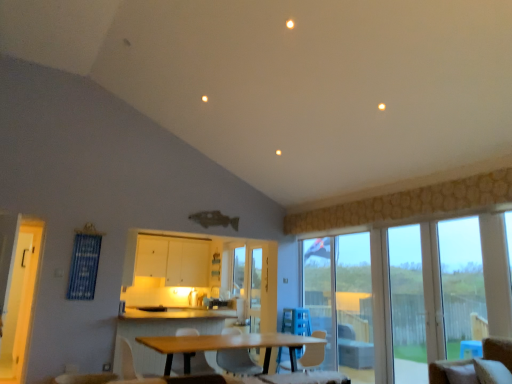
Question: Is the position of beige fabric chair at lower right, acting as the first chair starting from the front, more distant than that of white plastic armchair at center, which is counted as the 1th armchair, starting from the back?

Choices:
 (A) yes
 (B) no

Answer: (B)

Question: Can you confirm if beige fabric chair at lower right, acting as the 1th chair starting from the right, is smaller than white plastic armchair at center, which is counted as the 1th armchair, starting from the back?

Choices:
 (A) yes
 (B) no

Answer: (A)

Question: Is white plastic armchair at center, the 2th armchair positioned from the front, inside beige fabric chair at lower right, acting as the 1th chair starting from the right?

Choices:
 (A) yes
 (B) no

Answer: (B)

Question: Considering the relative sizes of beige fabric chair at lower right, the 3th chair when ordered from back to front, and white plastic armchair at center, which is counted as the 1th armchair, starting from the back, in the image provided, is beige fabric chair at lower right, the 3th chair when ordered from back to front, thinner than white plastic armchair at center, which is counted as the 1th armchair, starting from the back,?

Choices:
 (A) no
 (B) yes

Answer: (A)

Question: Is beige fabric chair at lower right, acting as the 1th chair starting from the right, to the right of white plastic armchair at center, which is counted as the 1th armchair, starting from the back, from the viewer's perspective?

Choices:
 (A) no
 (B) yes

Answer: (B)

Question: Is beige fabric chair at lower right, the third chair in the left-to-right sequence, looking in the opposite direction of white plastic armchair at center, the 2th armchair positioned from the front?

Choices:
 (A) no
 (B) yes

Answer: (A)

Question: From a real-world perspective, is white plastic armchair at center, which is counted as the 1th armchair, starting from the back, beneath transparent glass screen door at center, the 2th screen door positioned from the front?

Choices:
 (A) no
 (B) yes

Answer: (B)

Question: Considering the relative sizes of white plastic armchair at center, which is counted as the 1th armchair, starting from the back, and transparent glass screen door at center, the first screen door when ordered from right to left, in the image provided, is white plastic armchair at center, which is counted as the 1th armchair, starting from the back, bigger than transparent glass screen door at center, the first screen door when ordered from right to left,?

Choices:
 (A) no
 (B) yes

Answer: (B)

Question: From the image's perspective, is white plastic armchair at center, the 2th armchair positioned from the front, above transparent glass screen door at center, the 2th screen door in the left-to-right sequence?

Choices:
 (A) no
 (B) yes

Answer: (B)

Question: Does white plastic armchair at center, which is counted as the 1th armchair, starting from the back, have a smaller size compared to transparent glass screen door at center, the 2th screen door positioned from the front?

Choices:
 (A) yes
 (B) no

Answer: (B)

Question: Could you tell me if white plastic armchair at center, which is counted as the 1th armchair, starting from the back, is facing transparent glass screen door at center, the 2th screen door positioned from the front?

Choices:
 (A) no
 (B) yes

Answer: (A)

Question: Does white plastic armchair at center, which is counted as the 1th armchair, starting from the back, appear on the right side of transparent glass screen door at center, the 1th screen door from the back?

Choices:
 (A) no
 (B) yes

Answer: (A)

Question: Considering the relative sizes of white matte cabinet at center and clear glass door at right, acting as the first window starting from the left, in the image provided, is white matte cabinet at center wider than clear glass door at right, acting as the first window starting from the left,?

Choices:
 (A) no
 (B) yes

Answer: (B)